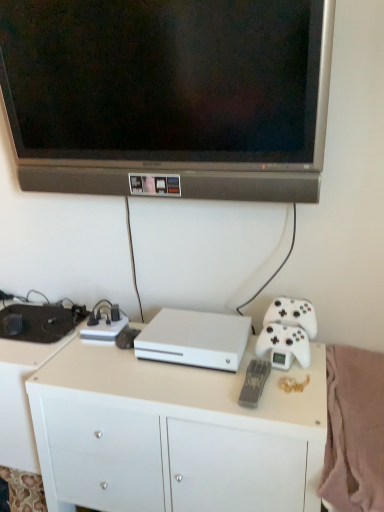
Question: Could you tell me if white matte game controller at right is facing white matte console at center?

Choices:
 (A) no
 (B) yes

Answer: (A)

Question: Can you confirm if white matte game controller at right is shorter than white matte console at center?

Choices:
 (A) yes
 (B) no

Answer: (B)

Question: Are white matte game controller at right and white matte console at center making contact?

Choices:
 (A) no
 (B) yes

Answer: (A)

Question: Does white matte game controller at right have a greater width compared to white matte console at center?

Choices:
 (A) yes
 (B) no

Answer: (B)

Question: Is white matte game controller at right oriented away from white matte console at center?

Choices:
 (A) no
 (B) yes

Answer: (A)

Question: In terms of height, does white matte desk at lower left, the second desk from the right, look taller or shorter compared to matte black television at upper center?

Choices:
 (A) short
 (B) tall

Answer: (B)

Question: Do you think white matte desk at lower left, placed as the 1th desk when sorted from left to right, is within matte black television at upper center, or outside of it?

Choices:
 (A) outside
 (B) inside

Answer: (A)

Question: Looking at the image, does white matte desk at lower left, placed as the 1th desk when sorted from left to right, seem bigger or smaller compared to matte black television at upper center?

Choices:
 (A) small
 (B) big

Answer: (B)

Question: Considering the relative positions of white matte desk at lower left, placed as the 1th desk when sorted from left to right, and matte black television at upper center in the image provided, is white matte desk at lower left, placed as the 1th desk when sorted from left to right, to the left or to the right of matte black television at upper center?

Choices:
 (A) right
 (B) left

Answer: (B)

Question: Visually, is matte black television at upper center positioned to the left or to the right of soft pink fleece blanket at lower right?

Choices:
 (A) right
 (B) left

Answer: (B)

Question: Is matte black television at upper center in front of or behind soft pink fleece blanket at lower right in the image?

Choices:
 (A) behind
 (B) front

Answer: (A)

Question: Considering the positions of matte black television at upper center and soft pink fleece blanket at lower right in the image, is matte black television at upper center taller or shorter than soft pink fleece blanket at lower right?

Choices:
 (A) short
 (B) tall

Answer: (B)

Question: From the image's perspective, relative to soft pink fleece blanket at lower right, is matte black television at upper center above or below?

Choices:
 (A) below
 (B) above

Answer: (B)

Question: From a real-world perspective, is white matte desk at lower left, placed as the 1th desk when sorted from left to right, above or below white matte desk at center, which ranks as the second desk in left-to-right order?

Choices:
 (A) below
 (B) above

Answer: (A)

Question: Considering the positions of white matte desk at lower left, the second desk from the right, and white matte desk at center, positioned as the 1th desk in right-to-left order, in the image, is white matte desk at lower left, the second desk from the right, taller or shorter than white matte desk at center, positioned as the 1th desk in right-to-left order,?

Choices:
 (A) short
 (B) tall

Answer: (A)